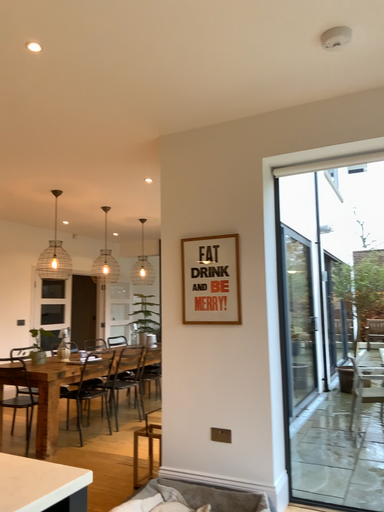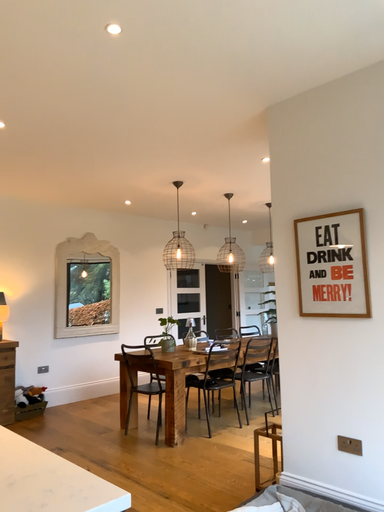
Question: How did the camera likely rotate when shooting the video?

Choices:
 (A) rotated right
 (B) rotated left

Answer: (B)